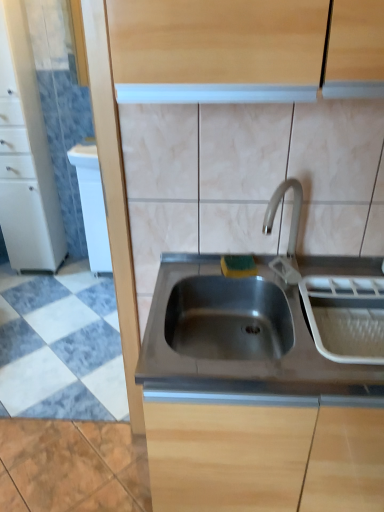
Question: Is the position of white glossy cabinet at left, marked as the first cabinetry in a left-to-right arrangement, more distant than that of white plastic dish rack at right?

Choices:
 (A) no
 (B) yes

Answer: (B)

Question: Does white glossy cabinet at left, positioned as the second cabinetry in bottom-to-top order, have a greater width compared to white plastic dish rack at right?

Choices:
 (A) no
 (B) yes

Answer: (A)

Question: Is white glossy cabinet at left, the 1th cabinetry positioned from the back, not inside white plastic dish rack at right?

Choices:
 (A) no
 (B) yes

Answer: (B)

Question: From a real-world perspective, is white glossy cabinet at left, placed as the first cabinetry when sorted from top to bottom, beneath white plastic dish rack at right?

Choices:
 (A) no
 (B) yes

Answer: (A)

Question: Can you confirm if white glossy cabinet at left, the 1th cabinetry positioned from the back, is taller than white plastic dish rack at right?

Choices:
 (A) no
 (B) yes

Answer: (B)

Question: Are stainless steel sink at center, which is the first cabinetry in bottom-to-top order, and stainless steel sink at center making contact?

Choices:
 (A) no
 (B) yes

Answer: (A)

Question: Does stainless steel sink at center, positioned as the 2th cabinetry in back-to-front order, have a larger size compared to stainless steel sink at center?

Choices:
 (A) yes
 (B) no

Answer: (A)

Question: Considering the relative sizes of stainless steel sink at center, the second cabinetry from the top, and stainless steel sink at center in the image provided, is stainless steel sink at center, the second cabinetry from the top, shorter than stainless steel sink at center?

Choices:
 (A) no
 (B) yes

Answer: (A)

Question: Considering the relative sizes of stainless steel sink at center, the first cabinetry positioned from the right, and stainless steel sink at center in the image provided, is stainless steel sink at center, the first cabinetry positioned from the right, smaller than stainless steel sink at center?

Choices:
 (A) no
 (B) yes

Answer: (A)

Question: Considering the relative positions of stainless steel sink at center, the first cabinetry positioned from the right, and stainless steel sink at center in the image provided, is stainless steel sink at center, the first cabinetry positioned from the right, behind stainless steel sink at center?

Choices:
 (A) yes
 (B) no

Answer: (A)

Question: Is stainless steel sink at center, the first cabinetry positioned from the right, looking in the opposite direction of stainless steel sink at center?

Choices:
 (A) no
 (B) yes

Answer: (A)

Question: Does white glossy dishwasher at left have a greater height compared to stainless steel sink at center, the first cabinetry positioned from the right?

Choices:
 (A) no
 (B) yes

Answer: (B)